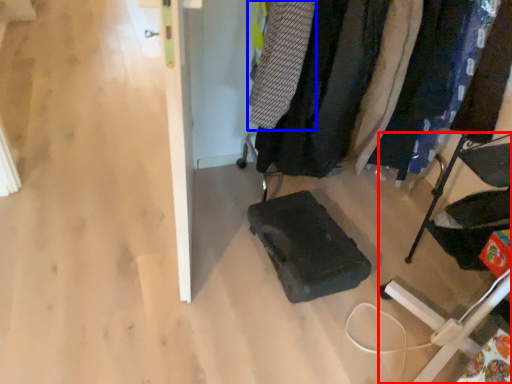
Question: Among these objects, which one is nearest to the camera, furniture (highlighted by a red box) or clothing (highlighted by a blue box)?

Choices:
 (A) furniture
 (B) clothing

Answer: (A)